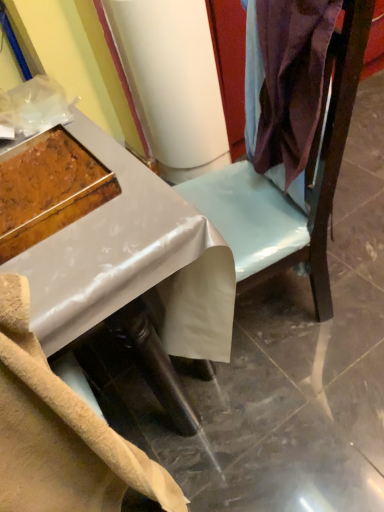
Question: Is wooden tray at left not near satin purple fabric at upper right?

Choices:
 (A) no
 (B) yes

Answer: (A)

Question: From the image's perspective, does wooden tray at left appear lower than satin purple fabric at upper right?

Choices:
 (A) yes
 (B) no

Answer: (A)

Question: From a real-world perspective, is wooden tray at left beneath satin purple fabric at upper right?

Choices:
 (A) yes
 (B) no

Answer: (B)

Question: Does wooden tray at left have a larger size compared to satin purple fabric at upper right?

Choices:
 (A) no
 (B) yes

Answer: (A)

Question: Is wooden tray at left further to camera compared to satin purple fabric at upper right?

Choices:
 (A) no
 (B) yes

Answer: (B)

Question: Considering the positions of white glossy desk at center and wooden tray at left in the image, is white glossy desk at center wider or thinner than wooden tray at left?

Choices:
 (A) wide
 (B) thin

Answer: (A)

Question: Is white glossy desk at center taller or shorter than wooden tray at left?

Choices:
 (A) tall
 (B) short

Answer: (A)

Question: From a real-world perspective, is white glossy desk at center positioned above or below wooden tray at left?

Choices:
 (A) above
 (B) below

Answer: (B)

Question: From the image's perspective, is white glossy desk at center above or below wooden tray at left?

Choices:
 (A) below
 (B) above

Answer: (A)

Question: Considering the positions of satin purple fabric at upper right and white glossy desk at center in the image, is satin purple fabric at upper right bigger or smaller than white glossy desk at center?

Choices:
 (A) big
 (B) small

Answer: (B)

Question: Considering the positions of satin purple fabric at upper right and white glossy desk at center in the image, is satin purple fabric at upper right taller or shorter than white glossy desk at center?

Choices:
 (A) short
 (B) tall

Answer: (A)

Question: Relative to white glossy desk at center, is satin purple fabric at upper right in front or behind?

Choices:
 (A) behind
 (B) front

Answer: (A)

Question: Looking at their shapes, would you say satin purple fabric at upper right is wider or thinner than white glossy desk at center?

Choices:
 (A) thin
 (B) wide

Answer: (A)

Question: Is wooden tray at left in front of or behind satin purple fabric at upper right in the image?

Choices:
 (A) front
 (B) behind

Answer: (B)

Question: Is wooden tray at left wider or thinner than satin purple fabric at upper right?

Choices:
 (A) wide
 (B) thin

Answer: (A)